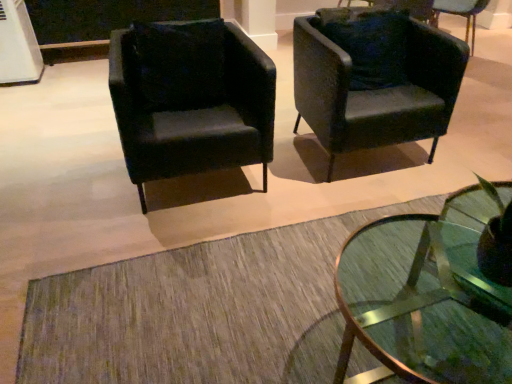
Where is `free spot to the left of clear glass coffee table at lower center`? The height and width of the screenshot is (384, 512). free spot to the left of clear glass coffee table at lower center is located at coordinates (211, 314).